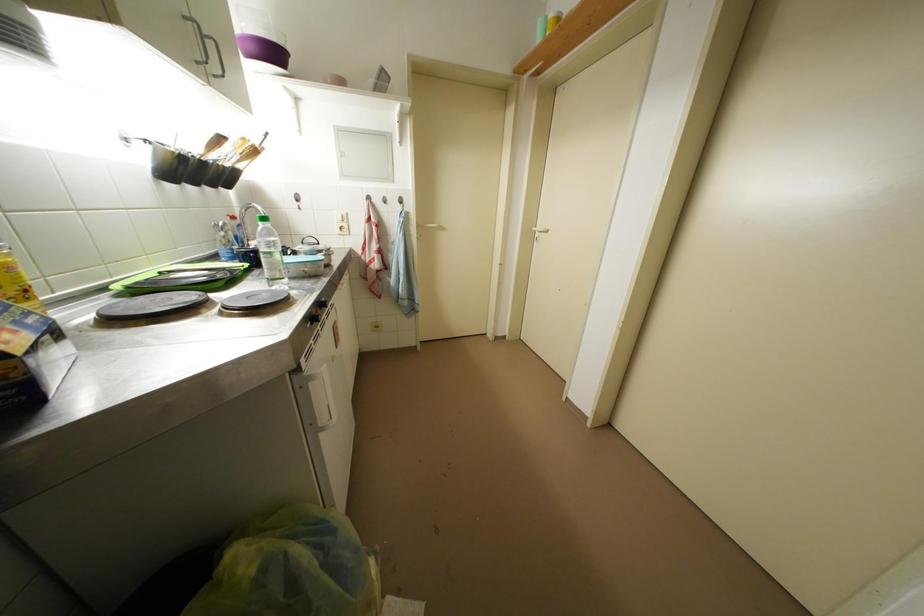
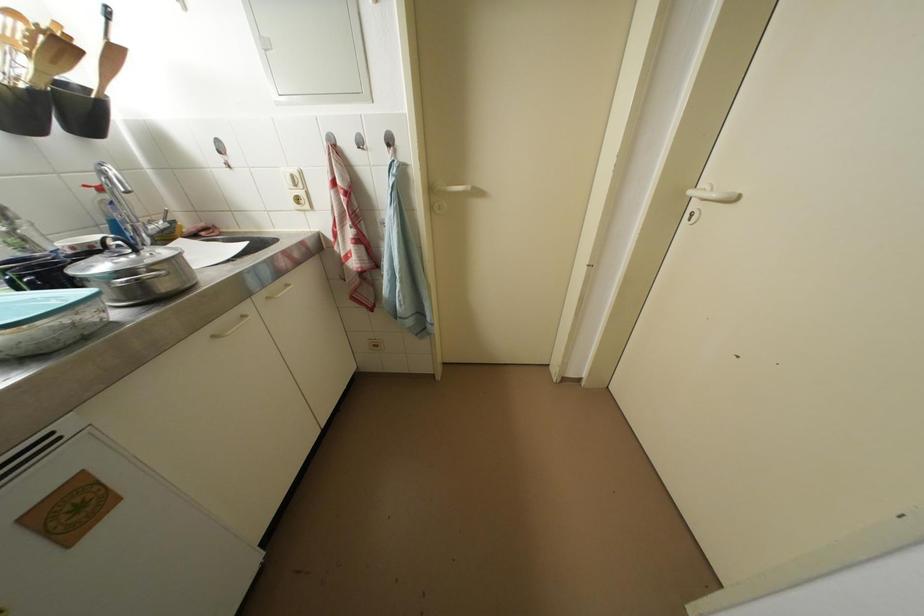
Find the pixel in the second image that matches point 261,155 in the first image.

(69, 50)